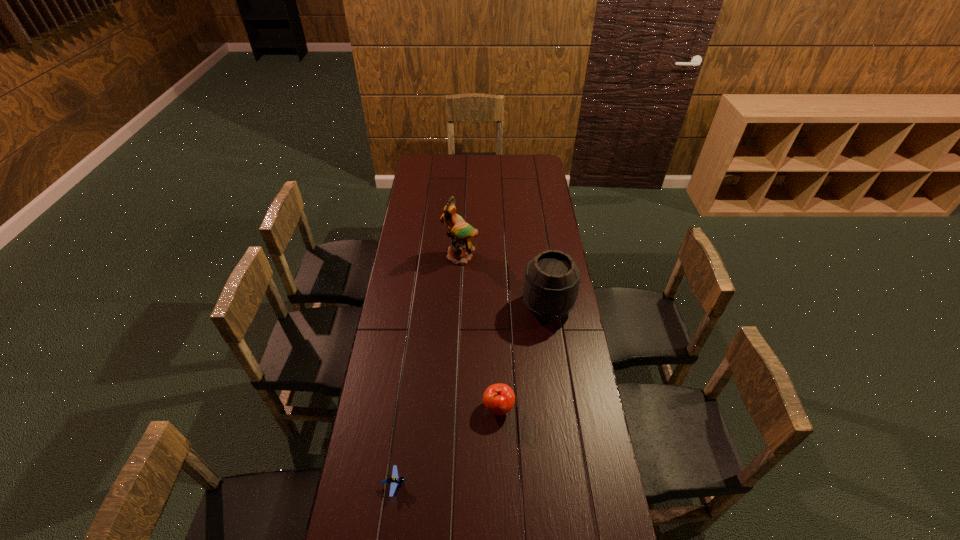
I want to click on the tallest object, so click(459, 252).

At what (x,y) coordinates should I click in order to perform the action: click on the third object from right to left. Please return your answer as a coordinate pair (x, y). This screenshot has height=540, width=960. Looking at the image, I should click on (459, 252).

At what (x,y) coordinates should I click in order to perform the action: click on the rightmost object. Please return your answer as a coordinate pair (x, y). Image resolution: width=960 pixels, height=540 pixels. Looking at the image, I should click on (551, 284).

I want to click on the second farthest object, so click(x=551, y=284).

Find the location of a particular element. This screenshot has height=540, width=960. the second nearest object is located at coordinates (499, 398).

Where is `apple`? Image resolution: width=960 pixels, height=540 pixels. apple is located at coordinates (499, 398).

Where is `Lego`? The width and height of the screenshot is (960, 540). Lego is located at coordinates (394, 481).

Locate an element on the screen. Image resolution: width=960 pixels, height=540 pixels. the shortest object is located at coordinates pos(394,481).

This screenshot has width=960, height=540. I want to click on vacant area situated 0.060m on the front-facing side of the parrot, so click(459, 276).

The image size is (960, 540). Identify the location of vacant region located 0.340m on the back of the rightmost object. (538, 239).